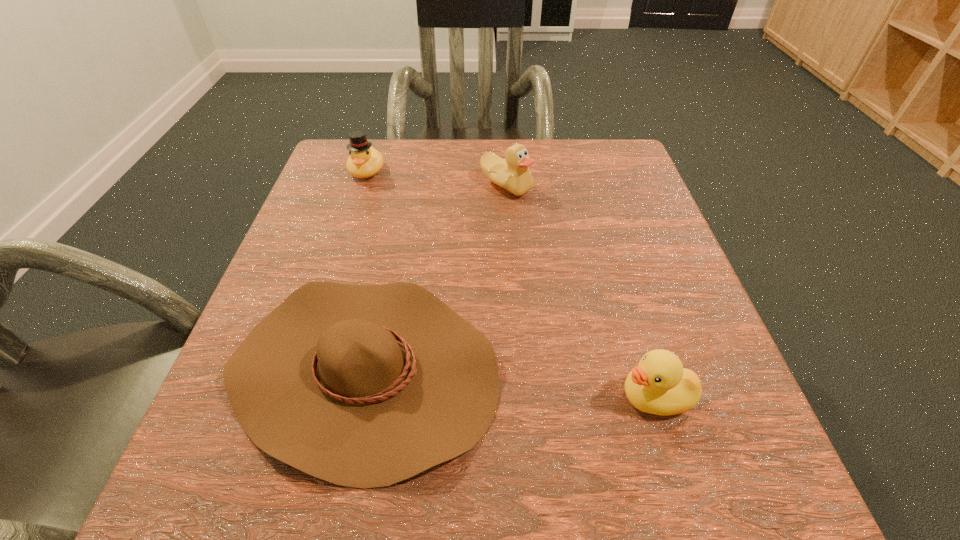
The image size is (960, 540). Find the location of `blank region between the second duck from left to right and the leftmost duck`. blank region between the second duck from left to right and the leftmost duck is located at coordinates (437, 178).

Find the location of a particular element. free area in between the second duck from right to left and the leftmost duck is located at coordinates (437, 178).

You are a GUI agent. You are given a task and a screenshot of the screen. Output one action in this format:
    pyautogui.click(x=<x>, y=<y>)
    Task: Click on the empty space that is in between the cowboy hat and the leftmost duck
    This screenshot has width=960, height=540.
    Given the screenshot: What is the action you would take?
    pyautogui.click(x=366, y=270)

Locate an element on the screen. The height and width of the screenshot is (540, 960). free area in between the shortest object and the leftmost duck is located at coordinates (366, 270).

Find the location of a particular element. object that is the second closest one to the rightmost object is located at coordinates (512, 174).

You are a GUI agent. You are given a task and a screenshot of the screen. Output one action in this format:
    pyautogui.click(x=<x>, y=<y>)
    Task: Click on the object that is the nearest to the cowboy hat
    The image size is (960, 540).
    Given the screenshot: What is the action you would take?
    pyautogui.click(x=659, y=385)

Locate an element on the screen. Image resolution: width=960 pixels, height=540 pixels. duck that is the closest to the shortest object is located at coordinates (659, 385).

Choose which duck is the third nearest neighbor to the shortest object. Please provide its 2D coordinates. Your answer should be formatted as a tuple, i.e. [(x, y)], where the tuple contains the x and y coordinates of a point satisfying the conditions above.

[(364, 161)]

Where is `free region that satisfies the following two spatial constraints: 1. on the front-facing side of the cowboy hat; 2. on the right side of the leftmost duck`? The height and width of the screenshot is (540, 960). free region that satisfies the following two spatial constraints: 1. on the front-facing side of the cowboy hat; 2. on the right side of the leftmost duck is located at coordinates (302, 369).

Find the location of `free location that satisfies the following two spatial constraints: 1. on the front-facing side of the shortest object; 2. on the left side of the leftmost duck`. free location that satisfies the following two spatial constraints: 1. on the front-facing side of the shortest object; 2. on the left side of the leftmost duck is located at coordinates (302, 369).